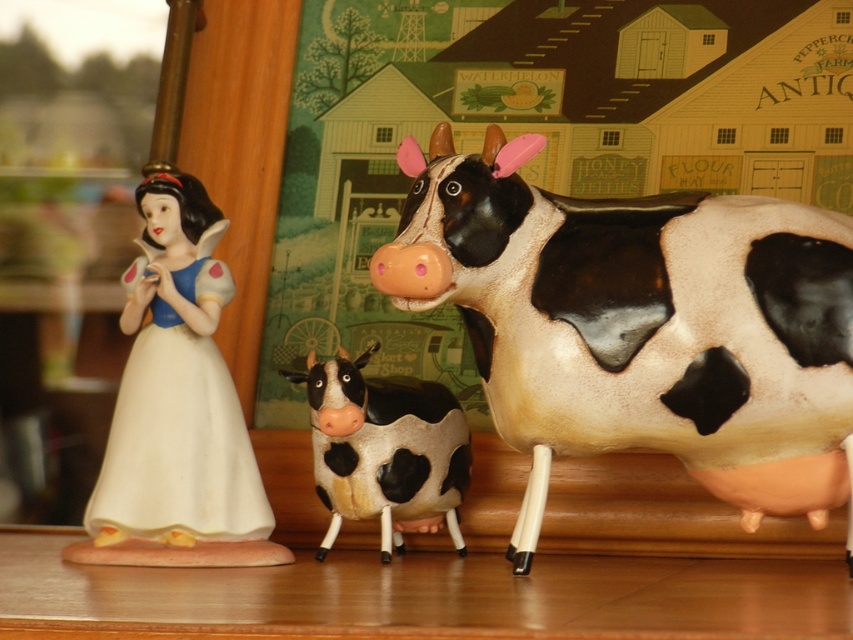
Question: Which of the following is the closest to the observer?

Choices:
 (A) pos(230,529)
 (B) pos(508,147)
 (C) pos(378,454)

Answer: (B)

Question: Which of these objects is positioned farthest from the black and white glossy cow at right?

Choices:
 (A) black and white ceramic cow at center
 (B) porcelain doll at left

Answer: (B)

Question: Is black and white glossy cow at right positioned at the back of black and white ceramic cow at center?

Choices:
 (A) yes
 (B) no

Answer: (B)

Question: Does porcelain doll at left have a lesser width compared to black and white ceramic cow at center?

Choices:
 (A) yes
 (B) no

Answer: (B)

Question: Can you confirm if porcelain doll at left is positioned to the left of black and white ceramic cow at center?

Choices:
 (A) yes
 (B) no

Answer: (A)

Question: Estimate the real-world distances between objects in this image. Which object is farther from the black and white ceramic cow at center?

Choices:
 (A) black and white glossy cow at right
 (B) porcelain doll at left

Answer: (A)